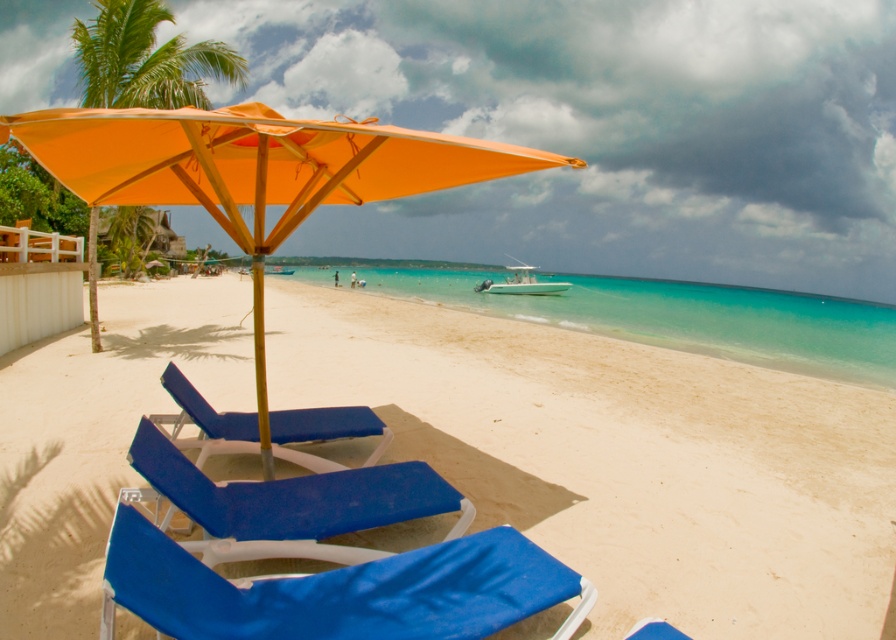
You are standing at the center of the beach scene and want to find the blue fabric beach chair at lower left. According to the coordinates provided, in which direction should you look to locate it?

The blue fabric beach chair at lower left is located at coordinates point (338, 589), so you should look to the lower left direction to find it.

You are planning to set up a beach umbrella for shade. You have two options based on the scene description. The first option is the blue fabric beach chair at lower left, and the second is the green leafy palm tree at upper left. Which object has a smaller width, making it more suitable for a compact umbrella setup?

The blue fabric beach chair at lower left has a smaller width than the green leafy palm tree at upper left, making it more suitable for a compact umbrella setup.